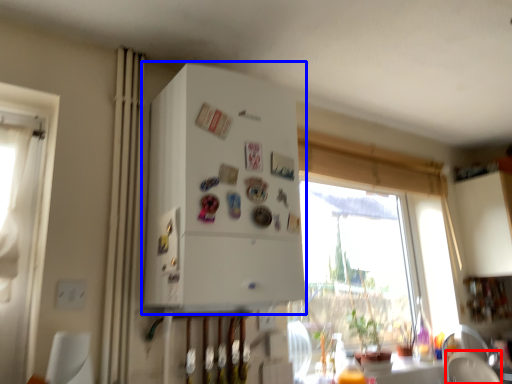
Question: Which object appears closest to the camera in this image, armchair (highlighted by a red box) or appliance (highlighted by a blue box)?

Choices:
 (A) armchair
 (B) appliance

Answer: (B)